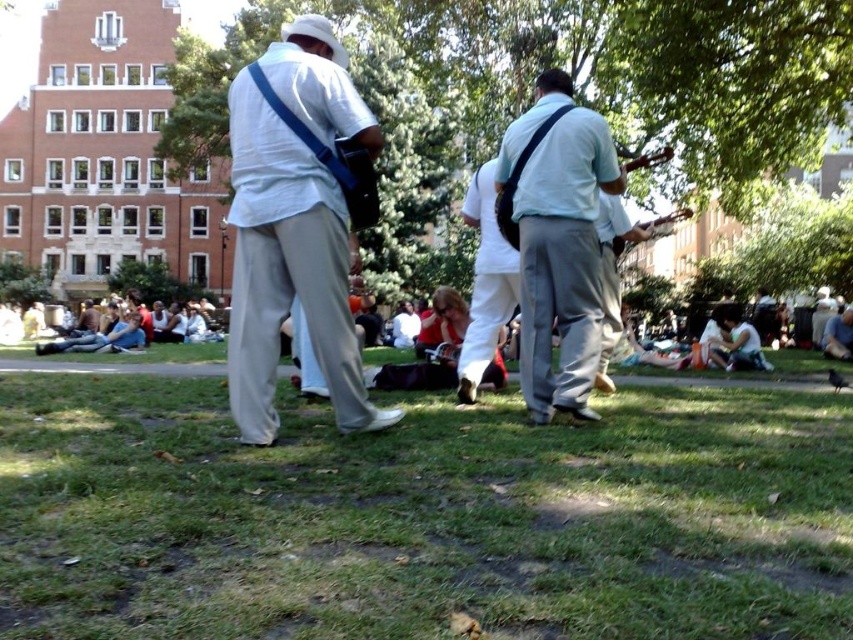
You are standing in the park and want to sit down on the green grass at lower center. To do so, you need to walk around the green leafy tree at center. Which direction should you move relative to the tree?

To reach the green grass at lower center, you should move to the right of the green leafy tree at center since the green grass at lower center is located to the right of the tree.

You are standing at the point labeled as point (370, 109) in the park. What object is located exactly at your current position?

The point (370, 109) indicates a green leafy tree at center.